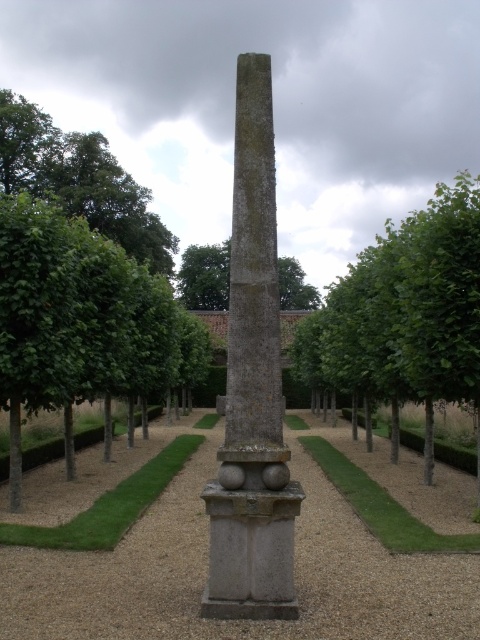
You are designing a garden layout and need to place a new statue that is 1 meter wide. You see the gray stone obelisk at center and the green leafy tree at center. Which object has a width that allows the statue to fit next to it without overlapping?

The gray stone obelisk at center has a width less than the green leafy tree at center, so the statue can fit next to the gray stone obelisk at center without overlapping since it is narrower.